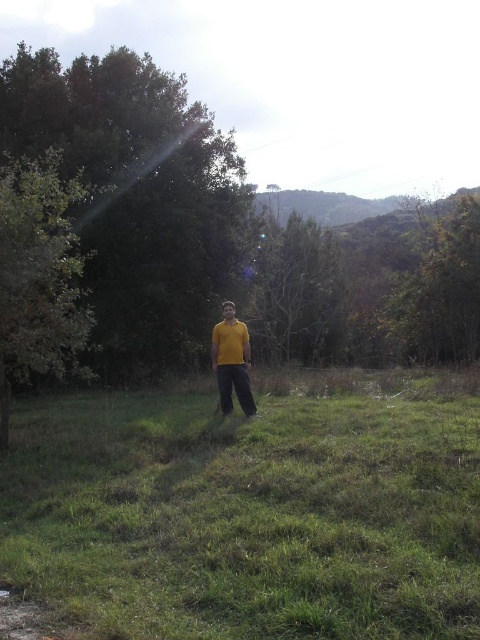
Is green grass at center shorter than yellow matte shirt at center?

Yes.

Which is in front, point (156, 632) or point (215, 342)?

Point (156, 632) is in front.

Locate an element on the screen. green grass at center is located at coordinates (252, 508).

Is green grass at center thinner than green leafy tree at center?

In fact, green grass at center might be wider than green leafy tree at center.

In the scene shown: Which of these two, green grass at center or green leafy tree at center, stands shorter?

green grass at center is shorter.

Does point (97, 506) come farther from viewer compared to point (127, 228)?

No, it is in front of (127, 228).

Identify the location of green grass at center. (252, 508).

Can you confirm if green leafy tree at left is taller than yellow matte shirt at center?

In fact, green leafy tree at left may be shorter than yellow matte shirt at center.

Measure the distance from green leafy tree at left to yellow matte shirt at center.

green leafy tree at left and yellow matte shirt at center are 3.60 meters apart from each other.

Is point (110, 189) positioned behind point (239, 397)?

Yes, it is behind point (239, 397).

The height and width of the screenshot is (640, 480). Identify the location of green leafy tree at left. (39, 275).